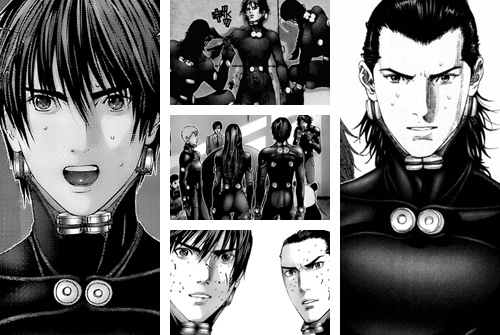
Locate an element on the screen. wall is located at coordinates (191, 8).